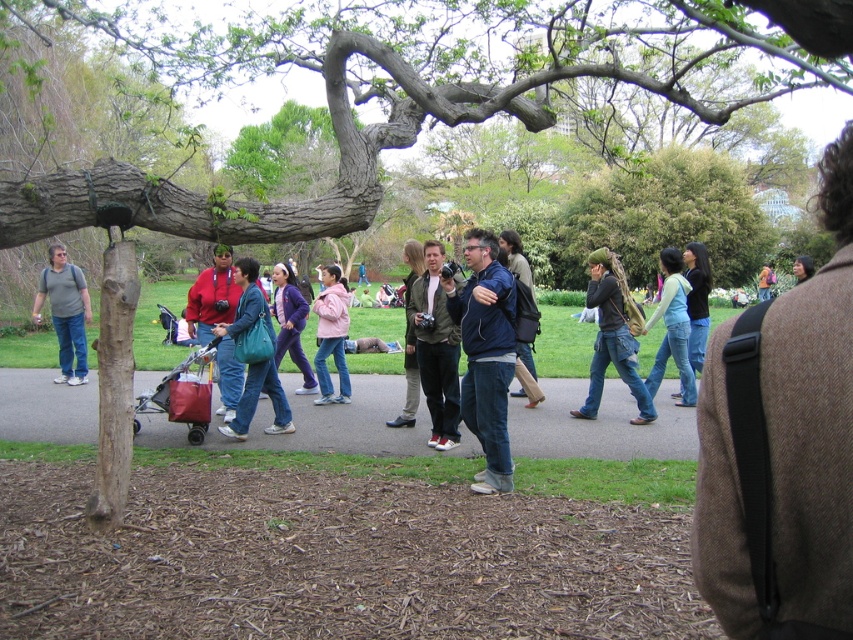
Can you confirm if matte blue jeans at center is positioned above matte gray shirt at left?

No, matte blue jeans at center is not above matte gray shirt at left.

Is matte blue jeans at center positioned at the back of matte gray shirt at left?

No.

Describe the element at coordinates (257, 400) in the screenshot. Image resolution: width=853 pixels, height=640 pixels. I see `matte blue jeans at center` at that location.

This screenshot has height=640, width=853. I want to click on matte blue jeans at center, so click(x=257, y=400).

Is green matte jacket at center thinner than camouflage-patterned backpack at center-right?

Yes.

Where is `green matte jacket at center`? green matte jacket at center is located at coordinates pos(436,348).

Which is in front, point (457, 337) or point (596, 362)?

Positioned in front is point (457, 337).

I want to click on green matte jacket at center, so click(436, 348).

Is blue denim jacket at center taller than green matte jacket at center?

Incorrect, blue denim jacket at center's height is not larger of green matte jacket at center's.

Describe the element at coordinates (485, 355) in the screenshot. I see `blue denim jacket at center` at that location.

Is point (494, 468) farther from viewer compared to point (444, 445)?

No, it is not.

Identify the location of blue denim jacket at center. This screenshot has width=853, height=640. click(x=485, y=355).